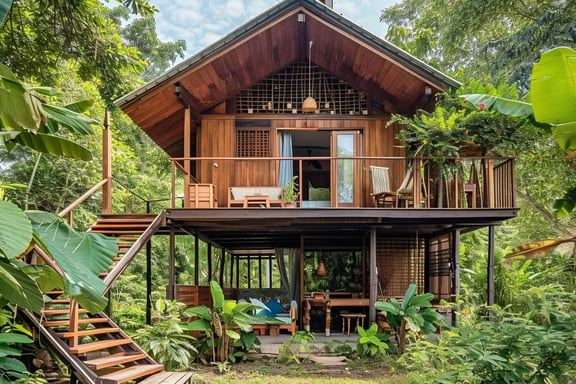
This screenshot has width=576, height=384. Identify the location of couch. (256, 195).